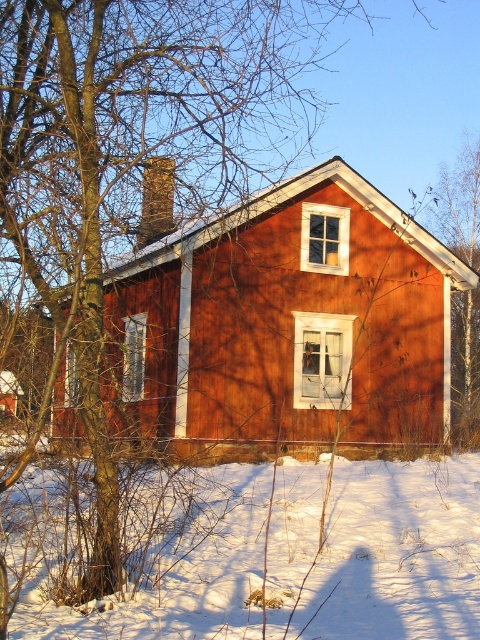
You are an observer standing in front of the wooden house. You notice the white powdery snow at lower center and the bare branches at upper right. Which of these two objects is taller from your viewpoint?

The bare branches at upper right are taller than the white powdery snow at lower center.

You are standing in front of the wooden house and want to place a small snowman exactly where the white powdery snow at lower center is located. According to the coordinates provided, where should you build the snowman?

You should build the snowman at the coordinates point (396, 554) where the white powdery snow at lower center is located.